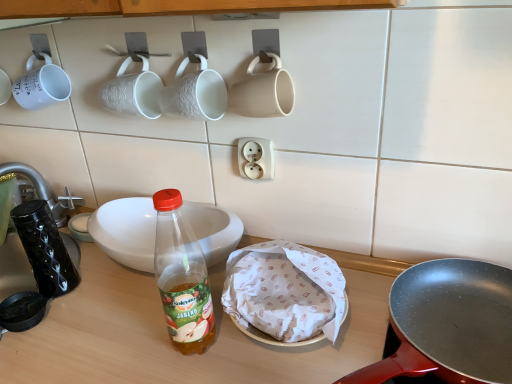
You are a GUI agent. You are given a task and a screenshot of the screen. Output one action in this format:
    pyautogui.click(x=<x>, y=<y>)
    Task: Click on the white textured mug at upper center, the 2th coffee cup in the left-to-right sequence
    The image size is (512, 384).
    Given the screenshot: What is the action you would take?
    pyautogui.click(x=133, y=91)

The width and height of the screenshot is (512, 384). What do you see at coordinates (449, 324) in the screenshot?
I see `matte black frying pan at center right` at bounding box center [449, 324].

Image resolution: width=512 pixels, height=384 pixels. Describe the element at coordinates (41, 85) in the screenshot. I see `white matte mug at upper left, the fourth coffee cup positioned from the right` at that location.

How much space does white matte mug at upper left, the fourth coffee cup positioned from the right, occupy horizontally?

white matte mug at upper left, the fourth coffee cup positioned from the right, is 4.56 inches in width.

Measure the distance between point (x=225, y=282) and camera.

Point (x=225, y=282) is 34.37 inches away from camera.

This screenshot has height=384, width=512. I want to click on translucent plastic bottle at center, so click(182, 277).

Image resolution: width=512 pixels, height=384 pixels. What do you see at coordinates (263, 91) in the screenshot?
I see `matte white mug at upper center, the 1th coffee cup from the right` at bounding box center [263, 91].

Find the location of a particular element. The image size is (512, 384). white textured mug at upper center, the 2th coffee cup in the left-to-right sequence is located at coordinates (133, 91).

Can you tell me how much white textured mug at upper center, the second coffee cup positioned from the right, and black glossy coffee cup at left differ in facing direction?

The angle between the facing direction of white textured mug at upper center, the second coffee cup positioned from the right, and the facing direction of black glossy coffee cup at left is 0.504 degrees.

Based on the photo, between white textured mug at upper center, the second coffee cup positioned from the right, and black glossy coffee cup at left, which one appears on the right side from the viewer's perspective?

white textured mug at upper center, the second coffee cup positioned from the right, is more to the right.

The height and width of the screenshot is (384, 512). In order to click on tableware on the left of white textured mug at upper center, the third coffee cup positioned from the left in this screenshot , I will do [x=39, y=253].

Which is in front, white paper wrapped food at center or matte black frying pan at center right?

matte black frying pan at center right is closer to the camera.

From a real-world perspective, between white paper wrapped food at center and matte black frying pan at center right, who is vertically higher?

matte black frying pan at center right is physically above.

From the image's perspective, between white paper wrapped food at center and matte black frying pan at center right, which one is located above?

matte black frying pan at center right, from the image's perspective.

Is black glossy coffee cup at left taller or shorter than white textured mug at upper center, the third coffee cup positioned from the left?

In the image, black glossy coffee cup at left appears to be taller than white textured mug at upper center, the third coffee cup positioned from the left.

This screenshot has height=384, width=512. What are the coordinates of `tableware that is below the white textured mug at upper center, the second coffee cup positioned from the right (from the image's perspective)` in the screenshot? It's located at (39, 253).

Consider the image. From a real-world perspective, is white ceramic bowl at center physically below translucent plastic bottle at center?

No, from a real-world perspective, white ceramic bowl at center is not under translucent plastic bottle at center.

Does white ceramic bowl at center have a smaller size compared to translucent plastic bottle at center?

Yes.

Which is in front, point (198, 227) or point (314, 363)?

The point (314, 363) is closer to the camera.

Between white ceramic bowl at center and translucent plastic bottle at center, which one is positioned behind?

white ceramic bowl at center is more distant.

Is matte black frying pan at center right located outside white paper wrapped food at center?

Indeed, matte black frying pan at center right is completely outside white paper wrapped food at center.

Considering the sizes of objects matte black frying pan at center right and white paper wrapped food at center in the image provided, who is thinner, matte black frying pan at center right or white paper wrapped food at center?

white paper wrapped food at center is thinner.

Is matte black frying pan at center right facing away from white paper wrapped food at center?

That's not correct — matte black frying pan at center right is not looking away from white paper wrapped food at center.

Considering the relative positions of matte black frying pan at center right and white paper wrapped food at center in the image provided, is matte black frying pan at center right to the right of white paper wrapped food at center from the viewer's perspective?

Yes, matte black frying pan at center right is to the right of white paper wrapped food at center.

Can you confirm if matte black frying pan at center right is bigger than white textured mug at upper center, the second coffee cup positioned from the right?

Yes, matte black frying pan at center right is bigger than white textured mug at upper center, the second coffee cup positioned from the right.

In the scene shown: Is matte black frying pan at center right directly adjacent to white textured mug at upper center, the second coffee cup positioned from the right?

matte black frying pan at center right and white textured mug at upper center, the second coffee cup positioned from the right, are clearly separated.

Looking at this image, could you measure the distance between matte black frying pan at center right and white textured mug at upper center, the third coffee cup positioned from the left?

They are 21.46 inches apart.

Who is smaller, matte white mug at upper center, the 1th coffee cup from the right, or white textured mug at upper center, the third coffee cup in the right-to-left sequence?

With smaller size is matte white mug at upper center, the 1th coffee cup from the right.

From their relative heights in the image, would you say matte white mug at upper center, the 1th coffee cup from the right, is taller or shorter than white textured mug at upper center, the 2th coffee cup in the left-to-right sequence?

Clearly, matte white mug at upper center, the 1th coffee cup from the right, is shorter compared to white textured mug at upper center, the 2th coffee cup in the left-to-right sequence.

From a real-world perspective, is matte white mug at upper center, the fourth coffee cup in the left-to-right sequence, located higher than white textured mug at upper center, the third coffee cup in the right-to-left sequence?

Yes, from a real-world perspective, matte white mug at upper center, the fourth coffee cup in the left-to-right sequence, is over white textured mug at upper center, the third coffee cup in the right-to-left sequence

Is matte white mug at upper center, the 1th coffee cup from the right, in contact with white textured mug at upper center, the 2th coffee cup in the left-to-right sequence?

No.

This screenshot has width=512, height=384. What are the coordinates of `coffee cup that is the 1st one when counting forward from the black glossy coffee cup at left` in the screenshot? It's located at (195, 93).

You are a GUI agent. You are given a task and a screenshot of the screen. Output one action in this format:
    pyautogui.click(x=<x>, y=<y>)
    Task: Click on the food to the left of matte black frying pan at center right
    The height and width of the screenshot is (384, 512).
    Given the screenshot: What is the action you would take?
    point(285,290)

Based on their spatial positions, is translucent plastic bottle at center or white matte mug at upper left, the fourth coffee cup positioned from the right, closer to white textured mug at upper center, the third coffee cup in the right-to-left sequence?

white matte mug at upper left, the fourth coffee cup positioned from the right, is positioned closer to the anchor white textured mug at upper center, the third coffee cup in the right-to-left sequence.

Looking at the image, which one is located further to white ceramic bowl at center, white matte mug at upper left, the fourth coffee cup positioned from the right, or translucent plastic bottle at center?

Based on the image, white matte mug at upper left, the fourth coffee cup positioned from the right, appears to be further to white ceramic bowl at center.

Based on their spatial positions, is white matte mug at upper left, the 1th coffee cup from the left, or white textured mug at upper center, the second coffee cup positioned from the right, closer to translucent plastic bottle at center?

The object closer to translucent plastic bottle at center is white textured mug at upper center, the second coffee cup positioned from the right.

Estimate the real-world distances between objects in this image. Which object is further from white textured mug at upper center, the 2th coffee cup in the left-to-right sequence, white matte mug at upper left, the 1th coffee cup from the left, or matte black frying pan at center right?

Among the two, matte black frying pan at center right is located further to white textured mug at upper center, the 2th coffee cup in the left-to-right sequence.

Looking at the image, which one is located closer to matte black frying pan at center right, white ceramic bowl at center or white textured mug at upper center, the third coffee cup in the right-to-left sequence?

Among the two, white ceramic bowl at center is located nearer to matte black frying pan at center right.

Considering their positions, is matte white mug at upper center, the 1th coffee cup from the right, positioned closer to white paper wrapped food at center than white ceramic bowl at center?

white ceramic bowl at center is closer to white paper wrapped food at center.

From the image, which object appears to be farther from white matte mug at upper left, the fourth coffee cup positioned from the right, white textured mug at upper center, the third coffee cup in the right-to-left sequence, or matte white mug at upper center, the fourth coffee cup in the left-to-right sequence?

The object further to white matte mug at upper left, the fourth coffee cup positioned from the right, is matte white mug at upper center, the fourth coffee cup in the left-to-right sequence.

Based on their spatial positions, is matte white mug at upper center, the 1th coffee cup from the right, or white ceramic bowl at center further from white textured mug at upper center, the third coffee cup in the right-to-left sequence?

Among the two, white ceramic bowl at center is located further to white textured mug at upper center, the third coffee cup in the right-to-left sequence.

Locate an element on the screen. food between white textured mug at upper center, the 2th coffee cup in the left-to-right sequence, and translucent plastic bottle at center in the up-down direction is located at coordinates (285, 290).

The image size is (512, 384). Identify the location of coffee cup that lies between white textured mug at upper center, the second coffee cup positioned from the right, and matte black frying pan at center right from top to bottom. (263, 91).

You are a GUI agent. You are given a task and a screenshot of the screen. Output one action in this format:
    pyautogui.click(x=<x>, y=<y>)
    Task: Click on the food between white textured mug at upper center, the 2th coffee cup in the left-to-right sequence, and matte black frying pan at center right from left to right
    
    Given the screenshot: What is the action you would take?
    pyautogui.click(x=285, y=290)

You are a GUI agent. You are given a task and a screenshot of the screen. Output one action in this format:
    pyautogui.click(x=<x>, y=<y>)
    Task: Click on the bottle between black glossy coffee cup at left and matte black frying pan at center right from left to right
    
    Given the screenshot: What is the action you would take?
    pyautogui.click(x=182, y=277)